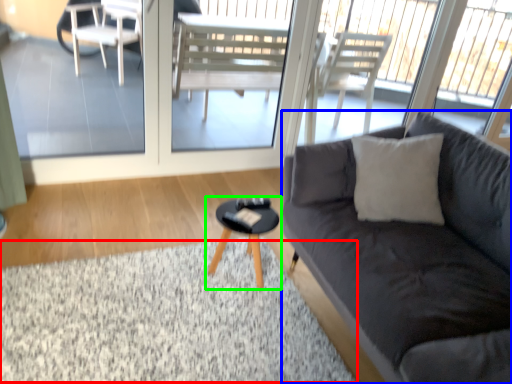
Question: Which is farther away from flat (highlighted by a red box)? studio couch (highlighted by a blue box) or coffee table (highlighted by a green box)?

Choices:
 (A) studio couch
 (B) coffee table

Answer: (A)